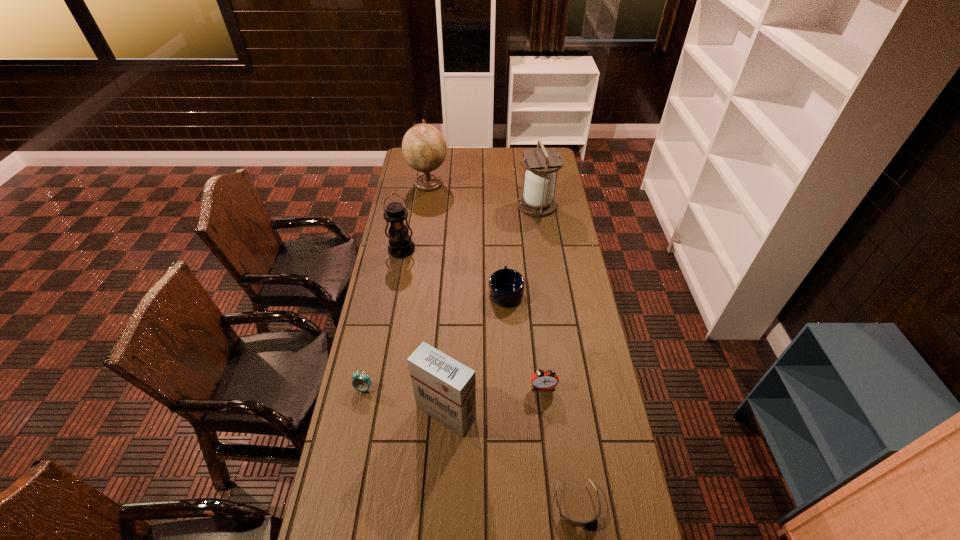
What are the coordinates of `goggles` in the screenshot? It's located at (576, 523).

Where is `free spot located 0.050m on the front-facing side of the globe`? This screenshot has width=960, height=540. free spot located 0.050m on the front-facing side of the globe is located at coordinates [458, 183].

You are a GUI agent. You are given a task and a screenshot of the screen. Output one action in this format:
    pyautogui.click(x=<x>, y=<y>)
    Task: Click on the vacant space located on the front of the farther lantern
    
    Given the screenshot: What is the action you would take?
    pyautogui.click(x=542, y=240)

Identify a few spots in the free region located 0.110m above the left lantern, indicating its light source. Please provide its 2D coordinates. Your answer should be formatted as a tuple, i.e. [(x, y)], where the tuple contains the x and y coordinates of a point satisfying the conditions above.

[(396, 278)]

The width and height of the screenshot is (960, 540). Identify the location of vacant space located 0.160m on the back of the cigarette case. (449, 351).

Where is `vacant region located on the clock face of the taller alarm clock`? This screenshot has width=960, height=540. vacant region located on the clock face of the taller alarm clock is located at coordinates 556,505.

Identify the location of free space located 0.050m with the handle on the side of the mug. This screenshot has height=540, width=960. (505, 269).

Locate an element on the screen. This screenshot has height=540, width=960. vacant space situated 0.170m with the handle on the side of the mug is located at coordinates (503, 250).

Find the location of a particular element. The height and width of the screenshot is (540, 960). vacant space situated with the handle on the side of the mug is located at coordinates (503, 240).

At what (x,y) coordinates should I click in order to perform the action: click on free space located on the face of the shorter alarm clock. Please return your answer as a coordinate pair (x, y). Looking at the image, I should click on (342, 493).